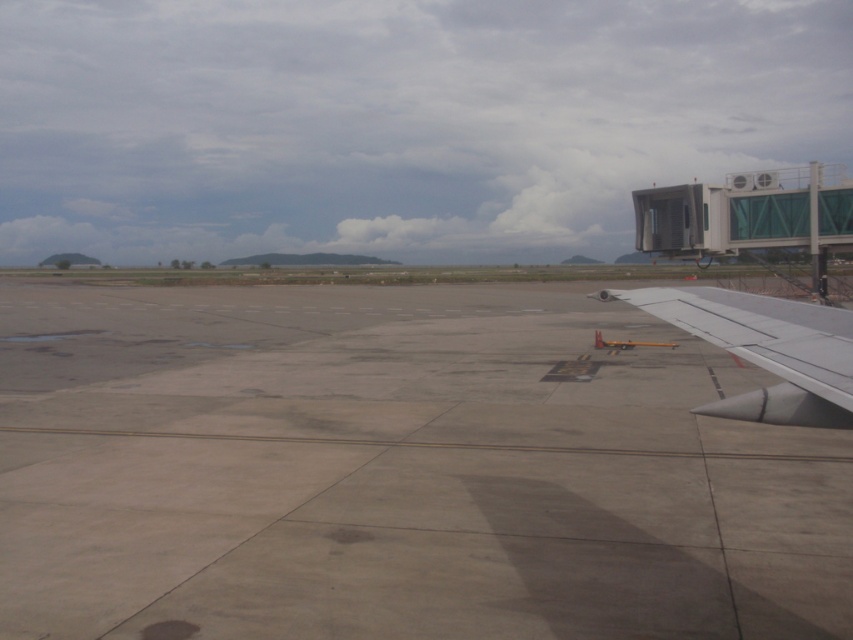
Can you confirm if gray concrete tarmac at center is shorter than silver metallic wing at lower right?

No.

Measure the distance between point (425, 298) and camera.

Point (425, 298) is 34.12 meters away from camera.

Image resolution: width=853 pixels, height=640 pixels. Identify the location of gray concrete tarmac at center. (397, 472).